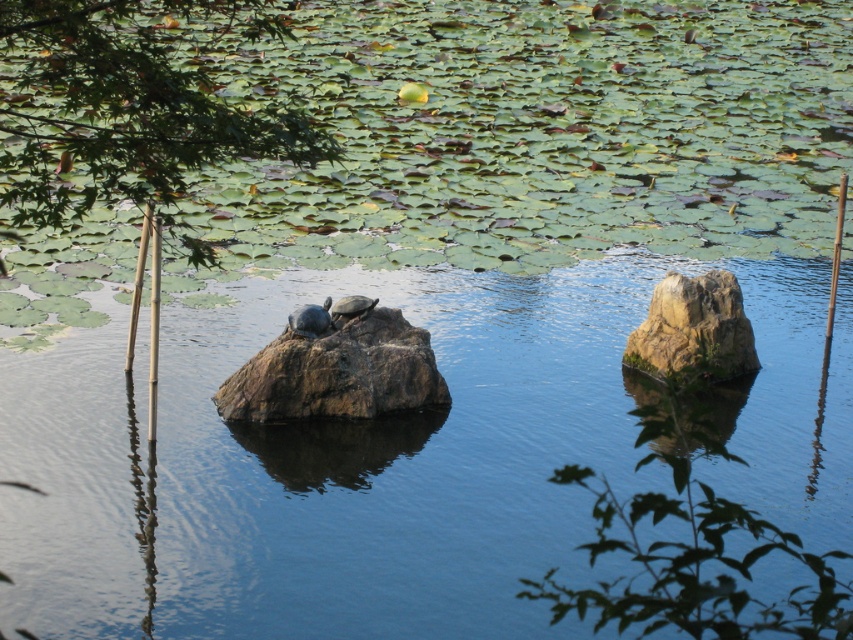
Question: Which point appears closest to the camera in this image?

Choices:
 (A) (321, 326)
 (B) (74, 435)
 (C) (288, 388)

Answer: (B)

Question: Can you confirm if brown rough rock at center is positioned to the left of smooth gray tortoise at center?

Choices:
 (A) no
 (B) yes

Answer: (B)

Question: Where is clear blue water at center located in relation to smooth gray tortoise at center in the image?

Choices:
 (A) above
 (B) below

Answer: (B)

Question: Which object is positioned closest to the smooth beige rock at right?

Choices:
 (A) smooth gray tortoise at center
 (B) clear blue water at center
 (C) brown rough rock at center
 (D) green leafy tree at upper left

Answer: (C)

Question: Is the position of shiny dark green tortoise at center-left less distant than that of smooth gray tortoise at center?

Choices:
 (A) yes
 (B) no

Answer: (A)

Question: Estimate the real-world distances between objects in this image. Which object is closer to the green leafy tree at upper left?

Choices:
 (A) brown rough rock at center
 (B) shiny dark green tortoise at center-left

Answer: (A)